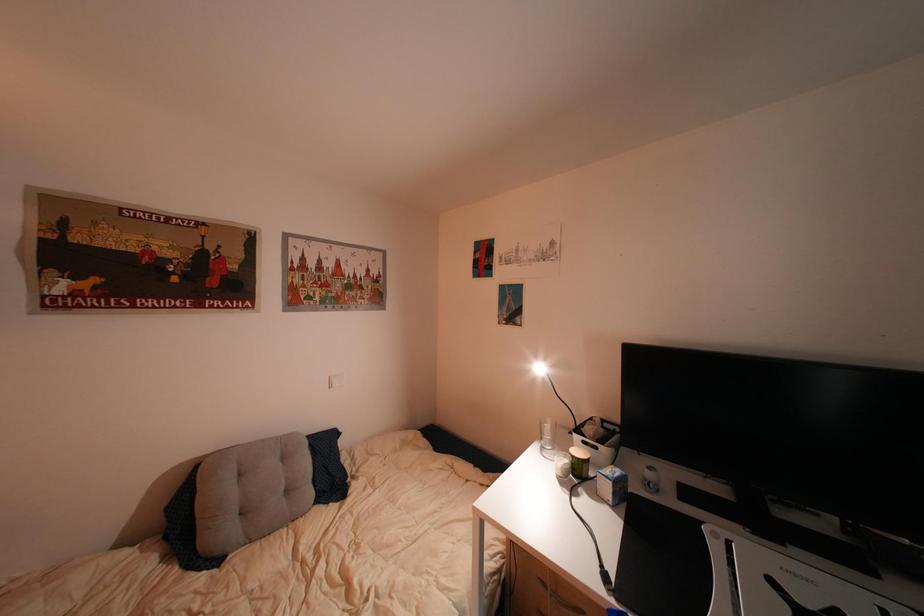
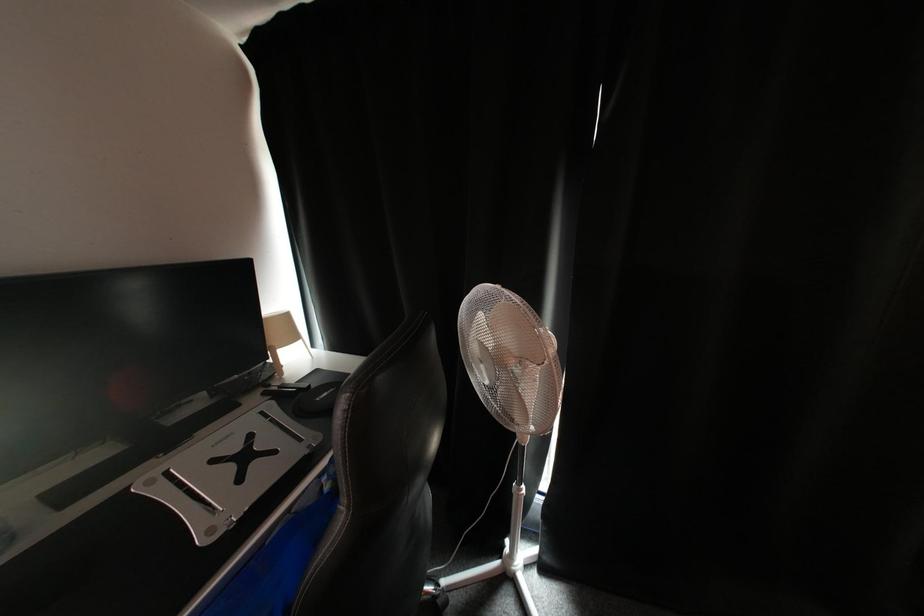
How did the camera likely rotate?

The rotation direction of the camera is right-down.